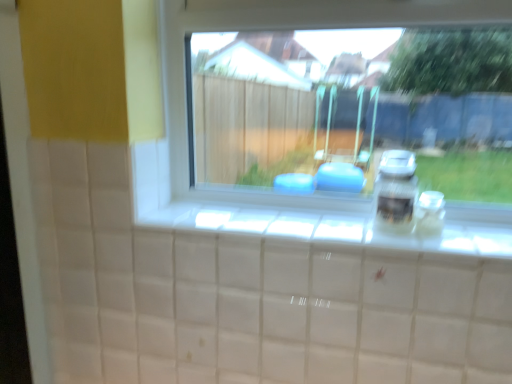
Question: Is transparent glass window at center aimed at transparent glass jar at right?

Choices:
 (A) no
 (B) yes

Answer: (B)

Question: From a real-world perspective, is transparent glass window at center beneath transparent glass jar at right?

Choices:
 (A) yes
 (B) no

Answer: (B)

Question: Is transparent glass window at center smaller than transparent glass jar at right?

Choices:
 (A) no
 (B) yes

Answer: (A)

Question: Can you confirm if transparent glass window at center is thinner than transparent glass jar at right?

Choices:
 (A) no
 (B) yes

Answer: (A)

Question: Is transparent glass window at center completely or partially outside of transparent glass jar at right?

Choices:
 (A) yes
 (B) no

Answer: (A)

Question: From a real-world perspective, is transparent glass jar at right above or below satin silver jar at right?

Choices:
 (A) above
 (B) below

Answer: (B)

Question: Considering the positions of transparent glass jar at right and satin silver jar at right in the image, is transparent glass jar at right bigger or smaller than satin silver jar at right?

Choices:
 (A) big
 (B) small

Answer: (B)

Question: Is transparent glass jar at right wider or thinner than satin silver jar at right?

Choices:
 (A) thin
 (B) wide

Answer: (A)

Question: From the image's perspective, is transparent glass jar at right located above or below satin silver jar at right?

Choices:
 (A) above
 (B) below

Answer: (B)

Question: Visually, is transparent glass window at center positioned to the left or to the right of transparent glass jar at right?

Choices:
 (A) left
 (B) right

Answer: (A)

Question: From the image's perspective, is transparent glass window at center above or below transparent glass jar at right?

Choices:
 (A) below
 (B) above

Answer: (B)

Question: Is point (170, 61) positioned closer to the camera than point (437, 210)?

Choices:
 (A) closer
 (B) farther

Answer: (B)

Question: Considering the positions of transparent glass window at center and transparent glass jar at right in the image, is transparent glass window at center bigger or smaller than transparent glass jar at right?

Choices:
 (A) small
 (B) big

Answer: (B)

Question: Is satin silver jar at right to the left or to the right of transparent glass window at center in the image?

Choices:
 (A) right
 (B) left

Answer: (A)

Question: Considering the positions of satin silver jar at right and transparent glass window at center in the image, is satin silver jar at right wider or thinner than transparent glass window at center?

Choices:
 (A) wide
 (B) thin

Answer: (B)